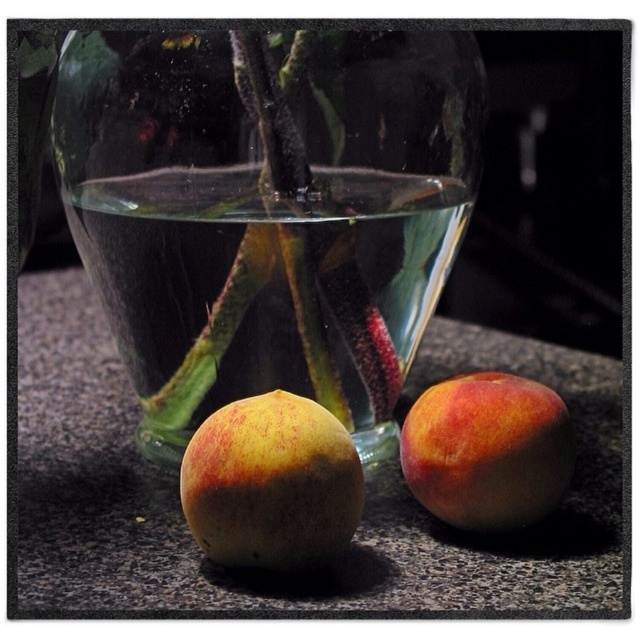
How much distance is there between ripe yellow peach at center and ripe peach at center?

ripe yellow peach at center and ripe peach at center are 1.48 inches apart.

Can you confirm if ripe yellow peach at center is wider than ripe peach at center?

Yes, ripe yellow peach at center is wider than ripe peach at center.

The height and width of the screenshot is (640, 640). Find the location of `ripe yellow peach at center`. ripe yellow peach at center is located at coordinates (272, 483).

Who is more forward, (64, 424) or (435, 467)?

Point (435, 467) is more forward.

Describe the element at coordinates (365, 484) in the screenshot. The width and height of the screenshot is (640, 640). I see `smooth granite surface at center` at that location.

Measure the distance between smooth granite surface at center and camera.

6.19 inches

Where is `smooth granite surface at center`? Image resolution: width=640 pixels, height=640 pixels. smooth granite surface at center is located at coordinates (365, 484).

Does smooth granite surface at center have a lesser width compared to ripe yellow peach at center?

In fact, smooth granite surface at center might be wider than ripe yellow peach at center.

From the picture: Who is positioned more to the left, smooth granite surface at center or ripe yellow peach at center?

Positioned to the left is smooth granite surface at center.

Does point (596, 380) lie behind point (320, 502)?

Yes, point (596, 380) is farther from viewer.

Find the location of a particular element. This screenshot has height=640, width=640. smooth granite surface at center is located at coordinates (365, 484).